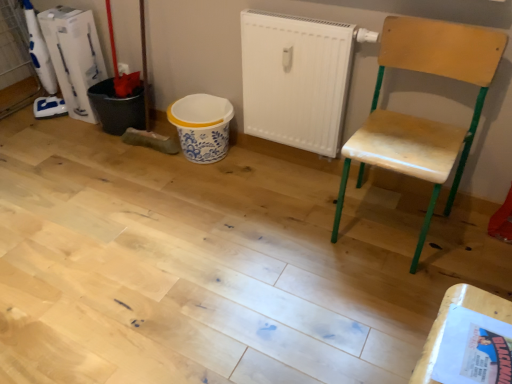
Where is `white matte radiator at center`? white matte radiator at center is located at coordinates (297, 78).

This screenshot has width=512, height=384. What do you see at coordinates (297, 78) in the screenshot?
I see `white matte radiator at center` at bounding box center [297, 78].

The width and height of the screenshot is (512, 384). Find the location of `wooden chair at right`. wooden chair at right is located at coordinates (421, 118).

Is point (80, 53) in front of point (421, 141)?

No, (80, 53) is further to viewer.

Who is more distant, white plastic bucket at left or wooden chair at right?

white plastic bucket at left is more distant.

Is white plastic bucket at left positioned with its back to wooden chair at right?

No, wooden chair at right is not at the back of white plastic bucket at left.

Is white plastic bucket at left touching wooden chair at right?

No, white plastic bucket at left is not beside wooden chair at right.

Is the position of wooden table at lower right more distant than that of white matte radiator at center?

No, the depth of wooden table at lower right is less than that of white matte radiator at center.

From a real-world perspective, between wooden table at lower right and white matte radiator at center, who is vertically higher?

wooden table at lower right.

Would you say wooden table at lower right is a long distance from white matte radiator at center?

Absolutely, wooden table at lower right is distant from white matte radiator at center.

Can you confirm if wooden table at lower right is positioned to the right of white matte radiator at center?

Indeed, wooden table at lower right is positioned on the right side of white matte radiator at center.

Between wooden chair at right and white matte radiator at center, which one has more height?

wooden chair at right is taller.

Is there a large distance between wooden chair at right and white matte radiator at center?

No, wooden chair at right is not far away from white matte radiator at center.

Relative to wooden table at lower right, is white matte radiator at center in front or behind?

In the image, white matte radiator at center appears behind wooden table at lower right.

Which is closer, (271, 134) or (426, 369)?

The point (426, 369) is in front.

From a real-world perspective, is white matte radiator at center positioned above or below wooden table at lower right?

Clearly, from a real-world perspective, white matte radiator at center is below wooden table at lower right.

Does white matte radiator at center have a larger size compared to wooden table at lower right?

Yes.

Are white plastic bucket at left and wooden table at lower right far apart?

Yes, white plastic bucket at left and wooden table at lower right are quite far apart.

From the image's perspective, does white plastic bucket at left appear higher than wooden table at lower right?

Yes.

Which of these two, white plastic bucket at left or wooden table at lower right, is thinner?

white plastic bucket at left.

Can you confirm if white plastic bucket at left is bigger than wooden table at lower right?

Yes.

Which of these two, wooden table at lower right or wooden chair at right, is wider?

wooden chair at right.

Which of these two, wooden table at lower right or wooden chair at right, is smaller?

Smaller between the two is wooden table at lower right.

Which is more to the right, wooden table at lower right or wooden chair at right?

wooden chair at right is more to the right.

From a real-world perspective, is wooden table at lower right physically below wooden chair at right?

No, from a real-world perspective, wooden table at lower right is not under wooden chair at right.

Is wooden chair at right in front of white plastic bucket at left?

Yes, wooden chair at right is closer to the camera.

From a real-world perspective, who is located lower, wooden chair at right or white plastic bucket at left?

white plastic bucket at left.

What's the angular difference between wooden chair at right and white plastic bucket at left's facing directions?

2.98 degrees separate the facing orientations of wooden chair at right and white plastic bucket at left.

Is point (440, 67) positioned behind point (81, 25)?

No.

At what (x,y) coordinates should I click in order to perform the action: click on chair in front of the white plastic bucket at left. Please return your answer as a coordinate pair (x, y). Image resolution: width=512 pixels, height=384 pixels. Looking at the image, I should click on (421, 118).

Identify the location of radiator above the wooden table at lower right (from the image's perspective). The width and height of the screenshot is (512, 384). (297, 78).

When comparing their distances from wooden table at lower right, does wooden chair at right or white plastic bucket at left seem further?

white plastic bucket at left.

Considering their positions, is white plastic bucket at left positioned closer to wooden chair at right than wooden table at lower right?

Result: wooden table at lower right lies closer to wooden chair at right than the other object.

Looking at the image, which one is located closer to white matte radiator at center, white plastic bucket at left or wooden chair at right?

wooden chair at right lies closer to white matte radiator at center than the other object.

Looking at the image, which one is located further to white matte radiator at center, white plastic bucket at left or wooden table at lower right?

wooden table at lower right is further to white matte radiator at center.

Looking at the image, which one is located closer to white plastic bucket at left, white matte radiator at center or wooden chair at right?

The object closer to white plastic bucket at left is white matte radiator at center.

Which object lies further to the anchor point white matte radiator at center, wooden table at lower right or wooden chair at right?

wooden table at lower right lies further to white matte radiator at center than the other object.

From the image, which object appears to be farther from white matte radiator at center, wooden chair at right or white plastic bucket at left?

white plastic bucket at left is positioned further to the anchor white matte radiator at center.

Looking at this image, based on their spatial positions, is white plastic bucket at left or wooden chair at right further from wooden table at lower right?

white plastic bucket at left is further to wooden table at lower right.

Locate an element on the screen. This screenshot has height=384, width=512. chair between wooden table at lower right and white matte radiator at center in the front-back direction is located at coordinates (421, 118).

The height and width of the screenshot is (384, 512). Find the location of `radiator located between white plastic bucket at left and wooden table at lower right in the left-right direction`. radiator located between white plastic bucket at left and wooden table at lower right in the left-right direction is located at coordinates (297, 78).

Identify the location of radiator between white plastic bucket at left and wooden chair at right. (297, 78).

You are a GUI agent. You are given a task and a screenshot of the screen. Output one action in this format:
    pyautogui.click(x=<x>, y=<y>)
    Task: Click on the table situated between white plastic bucket at left and wooden chair at right from left to right
    The image size is (512, 384).
    Given the screenshot: What is the action you would take?
    pyautogui.click(x=446, y=318)